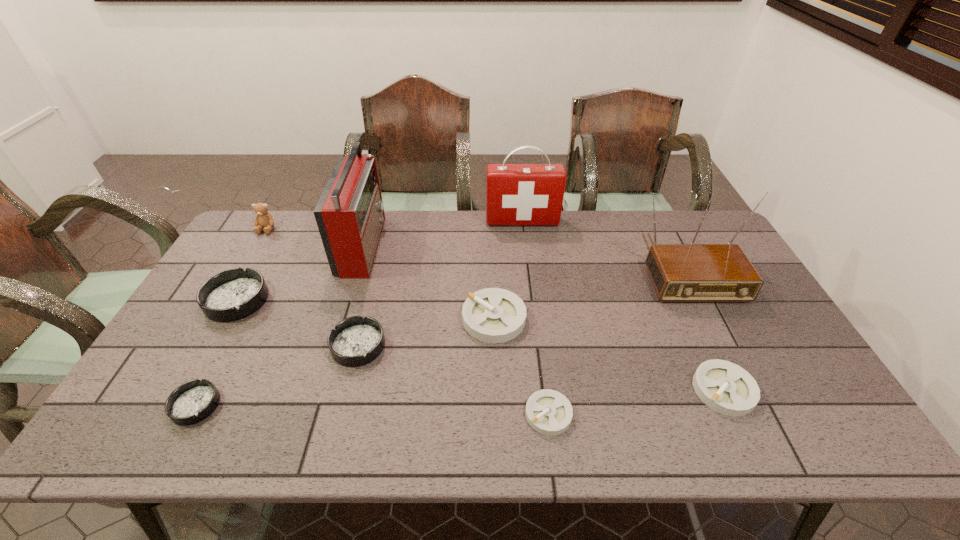
Find the location of a particular element. This screenshot has width=960, height=540. the second biggest gray ashtray is located at coordinates (725, 387).

Locate an element on the screen. The image size is (960, 540). the nearest dark ashtray is located at coordinates (193, 401).

Where is `the smallest gray ashtray`? Image resolution: width=960 pixels, height=540 pixels. the smallest gray ashtray is located at coordinates click(x=549, y=412).

This screenshot has width=960, height=540. I want to click on free point located on the front-facing side of the left radio_receiver, so click(x=482, y=245).

The image size is (960, 540). In order to click on vacant area situated 0.130m on the front face of the red first-aid kit in this screenshot , I will do `click(526, 251)`.

Find the location of `vacant space located on the front panel of the right radio_receiver`. vacant space located on the front panel of the right radio_receiver is located at coordinates (725, 348).

Where is `vacant space situated on the face of the teddy bear`? Image resolution: width=960 pixels, height=540 pixels. vacant space situated on the face of the teddy bear is located at coordinates (249, 260).

The height and width of the screenshot is (540, 960). Identify the location of vacant area situated 0.260m on the right of the biggest dark ashtray. (356, 300).

The image size is (960, 540). Find the location of `vacant space situated on the front of the biggest gray ashtray`. vacant space situated on the front of the biggest gray ashtray is located at coordinates (497, 435).

The image size is (960, 540). Identify the location of free space located on the front of the rightmost dark ashtray. (339, 422).